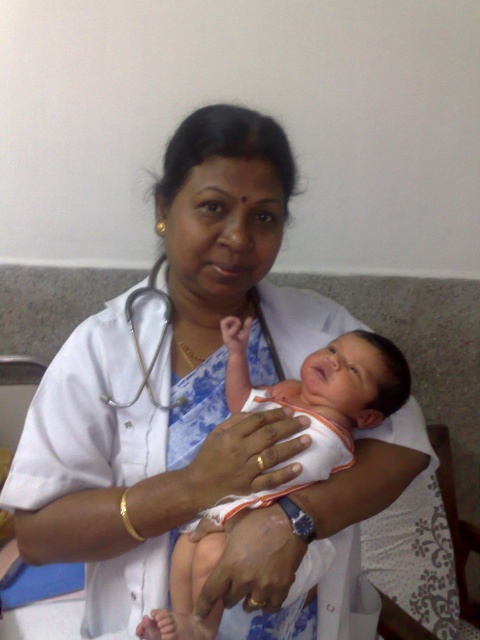
Question: Which of the following is the closest to the observer?

Choices:
 (A) white matte stethoscope at center
 (B) white cotton newborn at center

Answer: (B)

Question: Among these objects, which one is nearest to the camera?

Choices:
 (A) white matte stethoscope at center
 (B) white cotton newborn at center

Answer: (B)

Question: Can you confirm if white cotton newborn at center is thinner than white matte stethoscope at center?

Choices:
 (A) yes
 (B) no

Answer: (B)

Question: Can you confirm if white cotton newborn at center is smaller than white matte stethoscope at center?

Choices:
 (A) yes
 (B) no

Answer: (B)

Question: Does white cotton newborn at center have a greater width compared to white matte stethoscope at center?

Choices:
 (A) no
 (B) yes

Answer: (B)